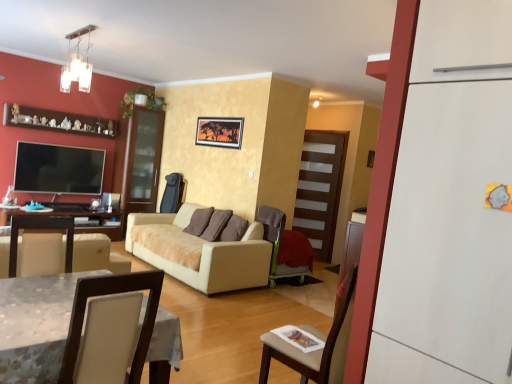
Question: Is velvet brown armchair at center, marked as the 2th chair in a front-to-back arrangement, taller than flat screen tv at left?

Choices:
 (A) no
 (B) yes

Answer: (B)

Question: Is velvet brown armchair at center, marked as the 2th chair in a front-to-back arrangement, not within flat screen tv at left?

Choices:
 (A) no
 (B) yes

Answer: (B)

Question: Can you confirm if velvet brown armchair at center, marked as the 2th chair in a front-to-back arrangement, is positioned to the right of flat screen tv at left?

Choices:
 (A) no
 (B) yes

Answer: (B)

Question: Is flat screen tv at left located within velvet brown armchair at center, the first chair positioned from the back?

Choices:
 (A) no
 (B) yes

Answer: (A)

Question: Considering the relative sizes of velvet brown armchair at center, arranged as the 2th chair when viewed from the left, and flat screen tv at left in the image provided, is velvet brown armchair at center, arranged as the 2th chair when viewed from the left, shorter than flat screen tv at left?

Choices:
 (A) no
 (B) yes

Answer: (A)

Question: Considering the positions of point (94, 150) and point (297, 218), is point (94, 150) closer or farther from the camera than point (297, 218)?

Choices:
 (A) farther
 (B) closer

Answer: (B)

Question: Based on their sizes in the image, would you say flat screen tv at left is bigger or smaller than transparent glass door at center?

Choices:
 (A) small
 (B) big

Answer: (A)

Question: Considering the relative positions of flat screen tv at left and transparent glass door at center in the image provided, is flat screen tv at left to the left or to the right of transparent glass door at center?

Choices:
 (A) left
 (B) right

Answer: (A)

Question: From their relative heights in the image, would you say flat screen tv at left is taller or shorter than transparent glass door at center?

Choices:
 (A) tall
 (B) short

Answer: (B)

Question: From a real-world perspective, is white matte refrigerator at right above or below transparent glass door at center?

Choices:
 (A) above
 (B) below

Answer: (A)

Question: Is white matte refrigerator at right inside the boundaries of transparent glass door at center, or outside?

Choices:
 (A) outside
 (B) inside

Answer: (A)

Question: From their relative heights in the image, would you say white matte refrigerator at right is taller or shorter than transparent glass door at center?

Choices:
 (A) tall
 (B) short

Answer: (B)

Question: Visually, is white matte refrigerator at right positioned to the left or to the right of transparent glass door at center?

Choices:
 (A) right
 (B) left

Answer: (B)

Question: Relative to white leather chair at lower left, arranged as the second chair when viewed from the back, is transparent glass door at center in front or behind?

Choices:
 (A) behind
 (B) front

Answer: (A)

Question: From a real-world perspective, is transparent glass door at center physically located above or below white leather chair at lower left, which ranks as the 1th chair in front-to-back order?

Choices:
 (A) above
 (B) below

Answer: (A)